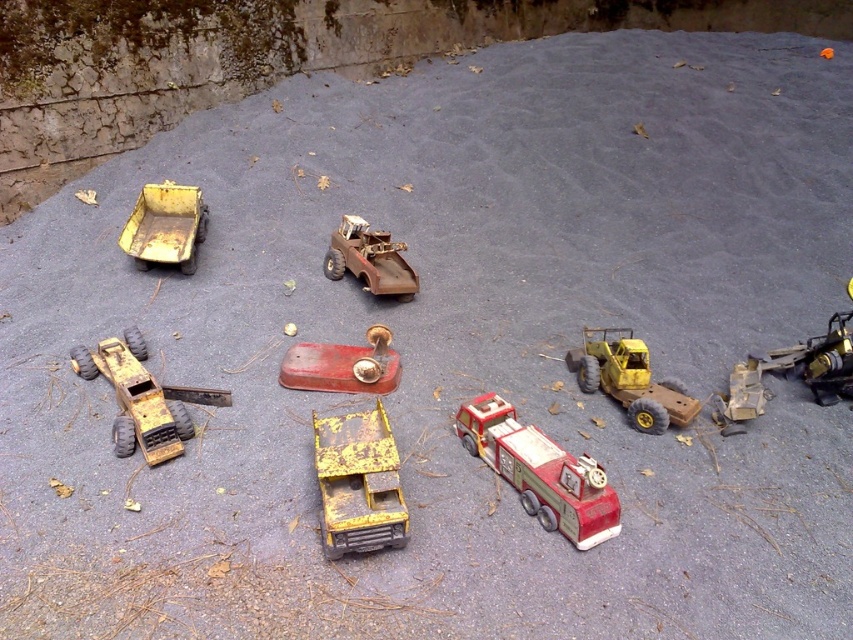
Question: Which object is closer to the camera taking this photo?

Choices:
 (A) red matte fire truck at center
 (B) yellow matte truck at center

Answer: (B)

Question: Can you confirm if yellow matte tractor at right is positioned below metallic red fire hydrant at center?

Choices:
 (A) no
 (B) yes

Answer: (A)

Question: Can you confirm if red matte fire truck at center is thinner than rusty metal tractor at lower left?

Choices:
 (A) no
 (B) yes

Answer: (B)

Question: Is red matte fire truck at center above gold metallic tractor at lower right?

Choices:
 (A) no
 (B) yes

Answer: (A)

Question: Among these points, which one is nearest to the camera?

Choices:
 (A) (817, 358)
 (B) (363, 275)

Answer: (A)

Question: Based on their relative distances, which object is nearer to the yellow matte truck at upper left?

Choices:
 (A) metallic red fire hydrant at center
 (B) gold metallic tractor at lower right
 (C) rusty metal truck at center
 (D) yellow matte tractor at right

Answer: (C)